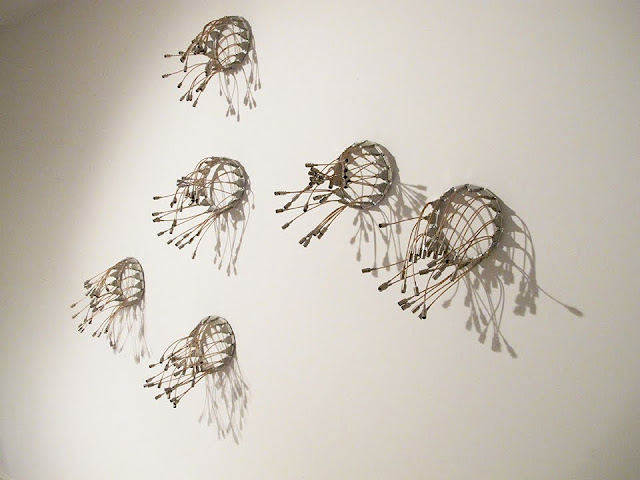
You are a GUI agent. You are given a task and a screenshot of the screen. Output one action in this format:
    pyautogui.click(x=<x>, y=<y>)
    Task: Click on the wall
    
    Given the screenshot: What is the action you would take?
    pyautogui.click(x=364, y=348)